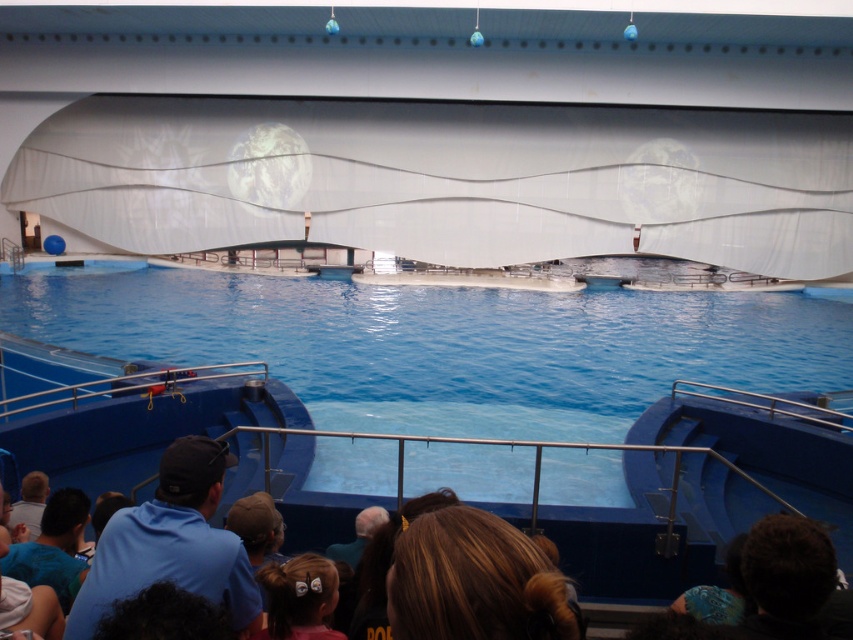
Which of these two, dark brown hair at lower right or blue shirt at lower left, stands shorter?

Standing shorter between the two is dark brown hair at lower right.

Which is in front, point (776, 598) or point (28, 580)?

Point (776, 598)

Who is more forward, (759, 616) or (53, 502)?

Point (759, 616)

Find the location of a particular element. This screenshot has width=853, height=640. dark brown hair at lower right is located at coordinates (786, 577).

Does blue smooth water at center have a greater width compared to blue shirt at lower left?

Correct, the width of blue smooth water at center exceeds that of blue shirt at lower left.

Measure the distance from blue smooth water at center to blue shirt at lower left.

They are 12.69 meters apart.

Is point (422, 308) farther from camera compared to point (86, 516)?

Yes, point (422, 308) is farther from viewer.

Locate an element on the screen. blue smooth water at center is located at coordinates (444, 344).

Does point (248, 528) come behind point (355, 548)?

No, (248, 528) is in front of (355, 548).

Which is above, brown fabric cap at center or brown hair at lower center?

brown fabric cap at center

Is point (267, 540) positioned before point (357, 540)?

Yes, it is.

Image resolution: width=853 pixels, height=640 pixels. Find the location of `brown fabric cap at center`. brown fabric cap at center is located at coordinates (254, 525).